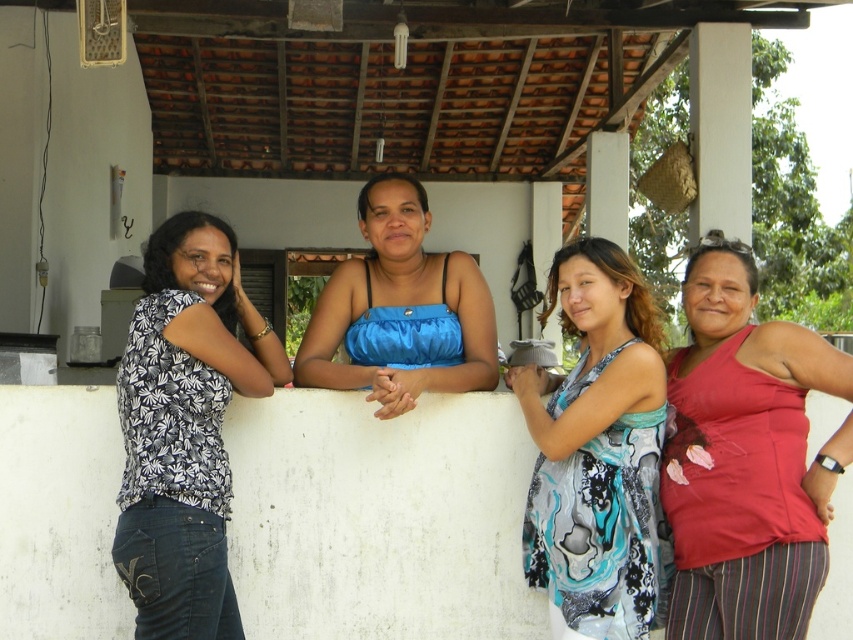
Question: Can you confirm if printed silk dress at center is wider than blue satin top at center?

Choices:
 (A) yes
 (B) no

Answer: (B)

Question: Can you confirm if matte red tank top at right is positioned below white printed blouse at left?

Choices:
 (A) yes
 (B) no

Answer: (B)

Question: Estimate the real-world distances between objects in this image. Which object is farther from the printed silk dress at center?

Choices:
 (A) matte red tank top at right
 (B) white printed blouse at left

Answer: (B)

Question: Can you confirm if white printed blouse at left is smaller than printed silk dress at center?

Choices:
 (A) no
 (B) yes

Answer: (A)

Question: Which object is positioned farthest from the printed silk dress at center?

Choices:
 (A) white printed blouse at left
 (B) blue satin top at center
 (C) matte red tank top at right

Answer: (A)

Question: Among these objects, which one is nearest to the camera?

Choices:
 (A) white printed blouse at left
 (B) blue satin top at center
 (C) printed silk dress at center

Answer: (A)